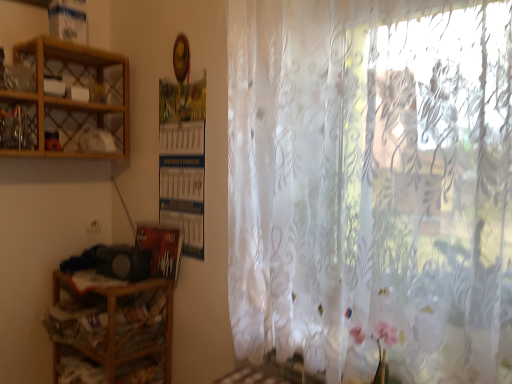
Question: From the image's perspective, does woodenobject at upper left, the first shelf viewed from the top, appear higher than wooden at left, which is the first shelf from bottom to top?

Choices:
 (A) yes
 (B) no

Answer: (A)

Question: From a real-world perspective, is woodenobject at upper left, the first shelf viewed from the top, below wooden at left, the 2th shelf from the top?

Choices:
 (A) yes
 (B) no

Answer: (B)

Question: Considering the relative positions of woodenobject at upper left, the 2th shelf in the bottom-to-top sequence, and wooden at left, which is the first shelf from bottom to top, in the image provided, is woodenobject at upper left, the 2th shelf in the bottom-to-top sequence, to the right of wooden at left, which is the first shelf from bottom to top, from the viewer's perspective?

Choices:
 (A) yes
 (B) no

Answer: (B)

Question: Could you tell me if woodenobject at upper left, the 2th shelf in the bottom-to-top sequence, is turned towards wooden at left, the 2th shelf from the top?

Choices:
 (A) no
 (B) yes

Answer: (A)

Question: Considering the relative sizes of woodenobject at upper left, the first shelf viewed from the top, and wooden at left, which is the first shelf from bottom to top, in the image provided, is woodenobject at upper left, the first shelf viewed from the top, taller than wooden at left, which is the first shelf from bottom to top,?

Choices:
 (A) no
 (B) yes

Answer: (A)

Question: Considering the relative sizes of woodenobject at upper left, the first shelf viewed from the top, and wooden at left, which is the first shelf from bottom to top, in the image provided, is woodenobject at upper left, the first shelf viewed from the top, bigger than wooden at left, which is the first shelf from bottom to top,?

Choices:
 (A) no
 (B) yes

Answer: (A)

Question: Does wooden at left, the 2th shelf from the top, have a greater width compared to translucent floral-patterned curtain at right?

Choices:
 (A) yes
 (B) no

Answer: (A)

Question: From a real-world perspective, is wooden at left, which is the first shelf from bottom to top, physically above translucent floral-patterned curtain at right?

Choices:
 (A) no
 (B) yes

Answer: (A)

Question: Considering the relative sizes of wooden at left, the 2th shelf from the top, and translucent floral-patterned curtain at right in the image provided, is wooden at left, the 2th shelf from the top, smaller than translucent floral-patterned curtain at right?

Choices:
 (A) yes
 (B) no

Answer: (A)

Question: Does wooden at left, the 2th shelf from the top, have a larger size compared to translucent floral-patterned curtain at right?

Choices:
 (A) yes
 (B) no

Answer: (B)

Question: Can you confirm if wooden at left, which is the first shelf from bottom to top, is positioned to the right of translucent floral-patterned curtain at right?

Choices:
 (A) yes
 (B) no

Answer: (B)

Question: Is translucent floral-patterned curtain at right a part of wooden at left, which is the first shelf from bottom to top?

Choices:
 (A) no
 (B) yes

Answer: (A)

Question: Is wooden cabinet at upper left smaller than wooden at left, which is the first shelf from bottom to top?

Choices:
 (A) no
 (B) yes

Answer: (B)